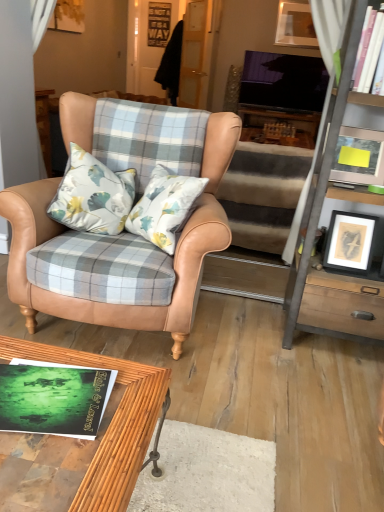
Question: Is metallic gray cabinet at right located within bamboo wood coffee table at lower center?

Choices:
 (A) no
 (B) yes

Answer: (A)

Question: Is bamboo wood coffee table at lower center oriented towards metallic gray cabinet at right?

Choices:
 (A) yes
 (B) no

Answer: (B)

Question: Is the position of bamboo wood coffee table at lower center less distant than that of metallic gray cabinet at right?

Choices:
 (A) no
 (B) yes

Answer: (B)

Question: Is bamboo wood coffee table at lower center next to metallic gray cabinet at right and touching it?

Choices:
 (A) yes
 (B) no

Answer: (B)

Question: Considering the relative sizes of bamboo wood coffee table at lower center and metallic gray cabinet at right in the image provided, is bamboo wood coffee table at lower center smaller than metallic gray cabinet at right?

Choices:
 (A) yes
 (B) no

Answer: (A)

Question: In terms of width, does bamboo wood coffee table at lower center look wider or thinner when compared to matte wooden picture frame at upper right, which is counted as the 1th picture frame, starting from the back?

Choices:
 (A) wide
 (B) thin

Answer: (A)

Question: From a real-world perspective, is bamboo wood coffee table at lower center physically located above or below matte wooden picture frame at upper right, the third picture frame when ordered from left to right?

Choices:
 (A) above
 (B) below

Answer: (B)

Question: Does point (107, 508) appear closer or farther from the camera than point (309, 36)?

Choices:
 (A) closer
 (B) farther

Answer: (A)

Question: Would you say bamboo wood coffee table at lower center is to the left or to the right of matte wooden picture frame at upper right, which is counted as the 1th picture frame, starting from the back, in the picture?

Choices:
 (A) right
 (B) left

Answer: (B)

Question: Based on their sizes in the image, would you say white carpet at lower center is bigger or smaller than white glossy bookshelf at upper right?

Choices:
 (A) big
 (B) small

Answer: (A)

Question: Relative to white glossy bookshelf at upper right, is white carpet at lower center in front or behind?

Choices:
 (A) behind
 (B) front

Answer: (B)

Question: Is white carpet at lower center to the left or to the right of white glossy bookshelf at upper right in the image?

Choices:
 (A) left
 (B) right

Answer: (A)

Question: Considering the positions of white carpet at lower center and white glossy bookshelf at upper right in the image, is white carpet at lower center taller or shorter than white glossy bookshelf at upper right?

Choices:
 (A) short
 (B) tall

Answer: (A)

Question: In terms of width, does white carpet at lower center look wider or thinner when compared to black matte picture frame at right, the 2th picture frame in the front-to-back sequence?

Choices:
 (A) thin
 (B) wide

Answer: (B)

Question: Based on their sizes in the image, would you say white carpet at lower center is bigger or smaller than black matte picture frame at right, the third picture frame in the top-to-bottom sequence?

Choices:
 (A) big
 (B) small

Answer: (A)